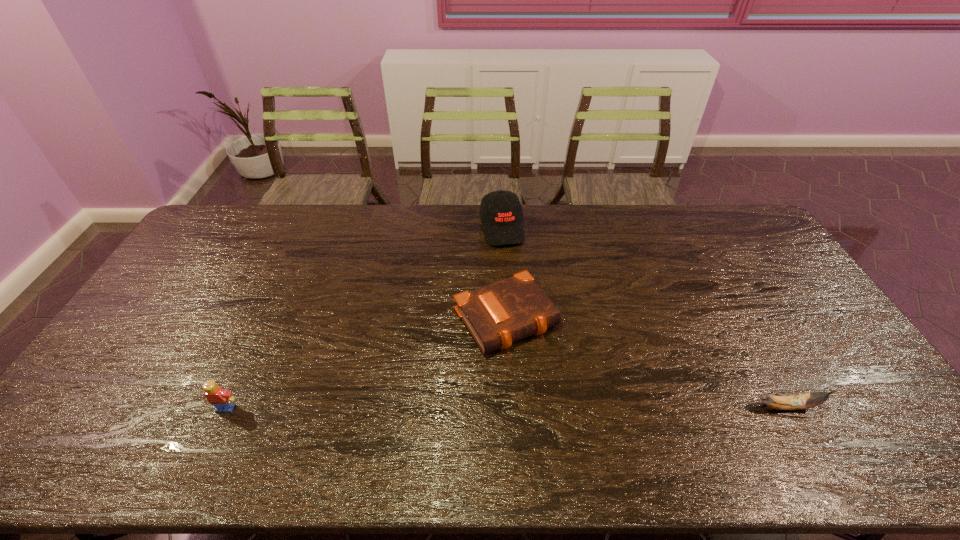
I want to click on vacant space located on the spine side of the shortest object, so click(577, 414).

At what (x,y) coordinates should I click in order to perform the action: click on vacant point located on the spine side of the shortest object. Please return your answer as a coordinate pair (x, y). The width and height of the screenshot is (960, 540). Looking at the image, I should click on (544, 369).

Where is `object that is positioned at the far edge`? This screenshot has height=540, width=960. object that is positioned at the far edge is located at coordinates (501, 211).

Image resolution: width=960 pixels, height=540 pixels. Find the location of `Lego located in the near edge section of the desktop`. Lego located in the near edge section of the desktop is located at coordinates (221, 398).

Locate an element on the screen. This screenshot has height=540, width=960. banana present at the near edge is located at coordinates (793, 402).

What are the coordinates of `free region at the far edge of the desktop` in the screenshot? It's located at pyautogui.click(x=540, y=222).

At what (x,y) coordinates should I click in order to perform the action: click on blank space at the near edge. Please return your answer as a coordinate pair (x, y). This screenshot has height=540, width=960. Looking at the image, I should click on (153, 400).

Locate an element on the screen. vacant space at the left edge is located at coordinates (161, 287).

This screenshot has width=960, height=540. In the image, there is a desktop. What are the coordinates of `free space at the right edge` in the screenshot? It's located at (754, 275).

At what (x,y) coordinates should I click in order to perform the action: click on free space at the near left corner of the desktop. Please return your answer as a coordinate pair (x, y). The image size is (960, 540). Looking at the image, I should click on (79, 402).